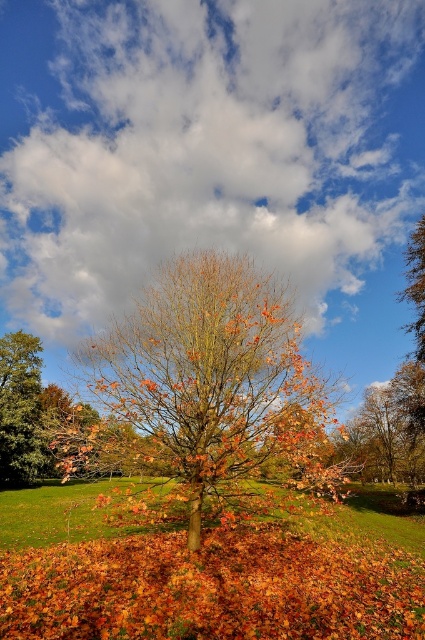
Who is taller, white fluffy cloud at upper center or orange-brown leaves at center?

white fluffy cloud at upper center is taller.

Is white fluffy cloud at upper center bigger than orange-brown leaves at center?

Correct, white fluffy cloud at upper center is larger in size than orange-brown leaves at center.

Between point (104, 161) and point (6, 397), which one is positioned behind?

Positioned behind is point (6, 397).

Find the location of `white fluffy cloud at upper center`. white fluffy cloud at upper center is located at coordinates (195, 145).

Is orange-brown bark tree at center behind green grass at center?

No, it is not.

Does orange-brown bark tree at center appear on the left side of green grass at center?

No, orange-brown bark tree at center is not to the left of green grass at center.

You are a GUI agent. You are given a task and a screenshot of the screen. Output one action in this format:
    pyautogui.click(x=<x>, y=<y>)
    Task: Click on the orange-brown bark tree at center
    The height and width of the screenshot is (640, 425).
    Given the screenshot: What is the action you would take?
    pyautogui.click(x=212, y=376)

Can you confirm if white fluffy cloud at upper center is positioned to the right of orange-brown bark tree at center?

In fact, white fluffy cloud at upper center is to the left of orange-brown bark tree at center.

Locate an element on the screen. The height and width of the screenshot is (640, 425). white fluffy cloud at upper center is located at coordinates (195, 145).